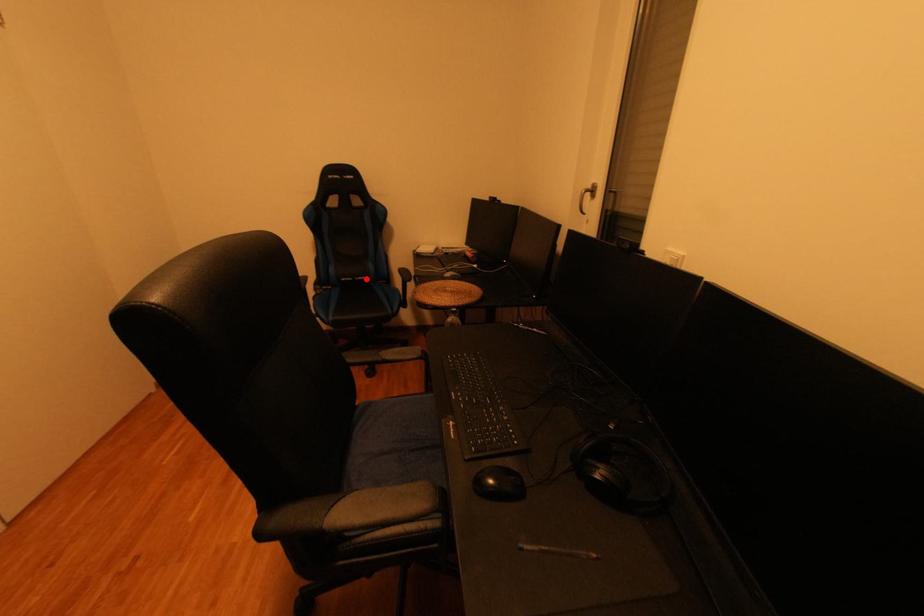
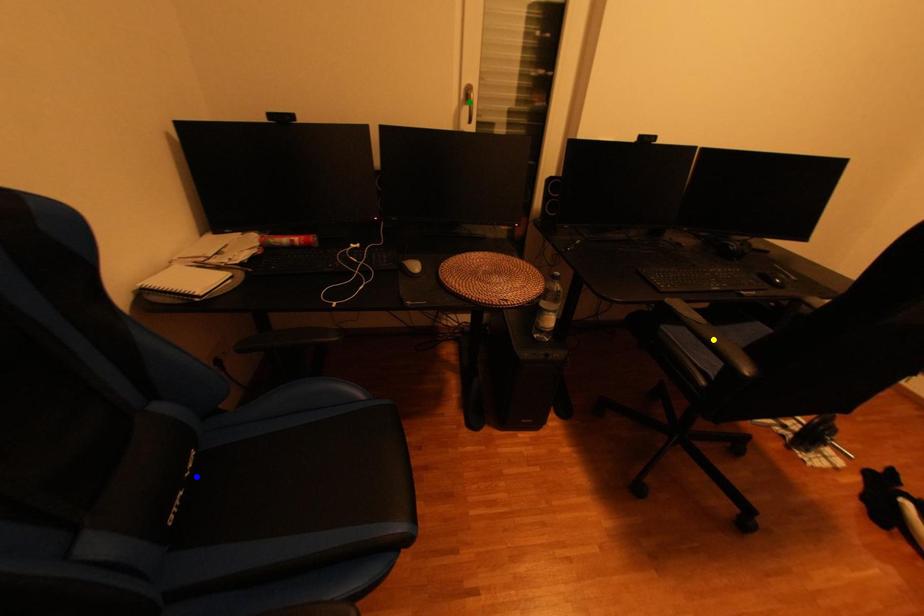
Question: I am providing you with two images of the same scene from different viewpoints. A red point is marked on the first image. You are given multiple points on the second image. Which mark in image 2 goes with the point in image 1?

Choices:
 (A) green point
 (B) yellow point
 (C) blue point

Answer: (C)